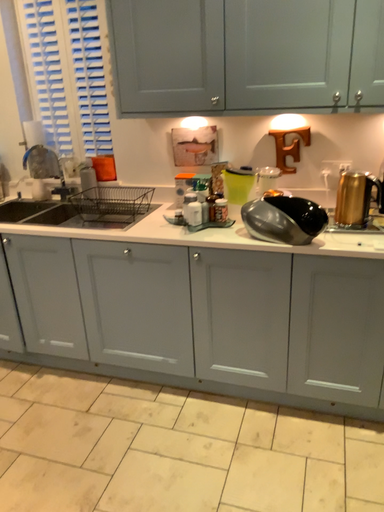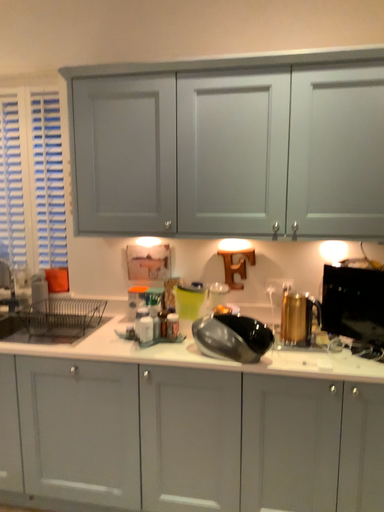
Question: Which way did the camera rotate in the video?

Choices:
 (A) rotated upward
 (B) rotated downward

Answer: (A)